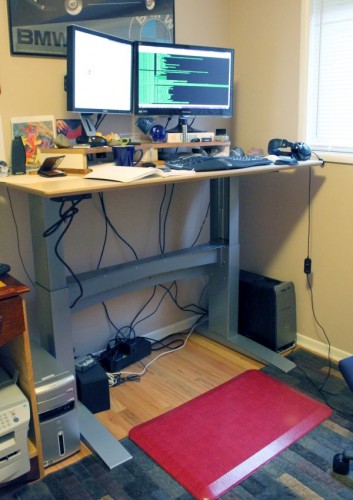
Find the location of a particular element. This screenshot has height=500, width=353. black ergonomic computer keyboard is located at coordinates (188, 160).